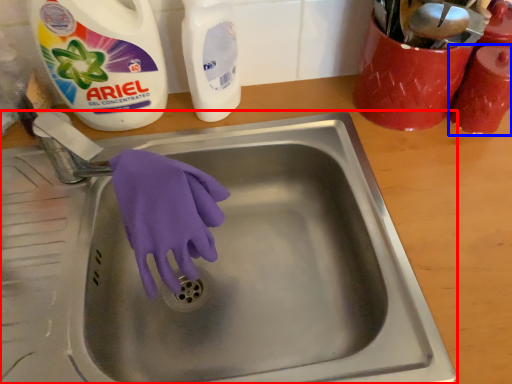
Question: Which object appears farthest to the camera in this image, sink (highlighted by a red box) or cleaning product (highlighted by a blue box)?

Choices:
 (A) sink
 (B) cleaning product

Answer: (B)